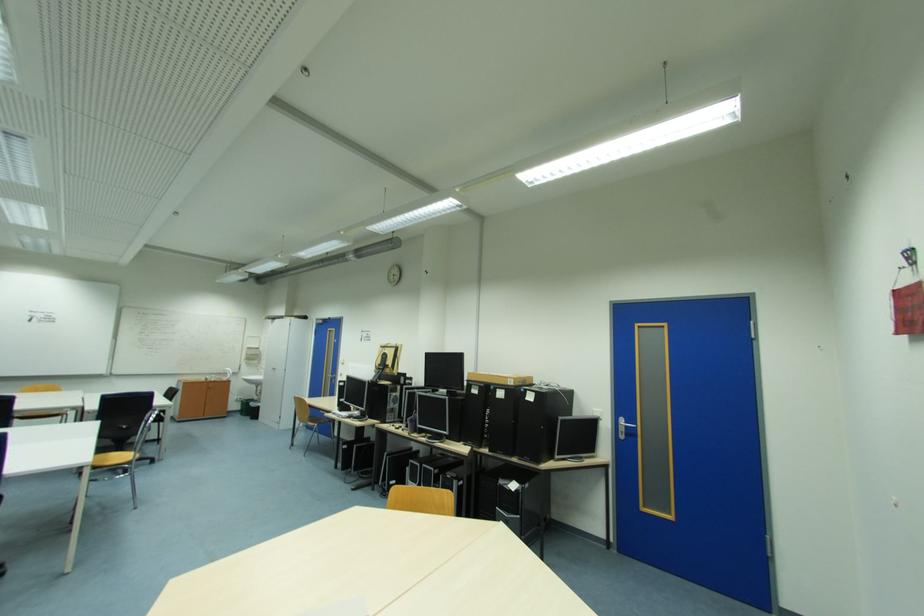
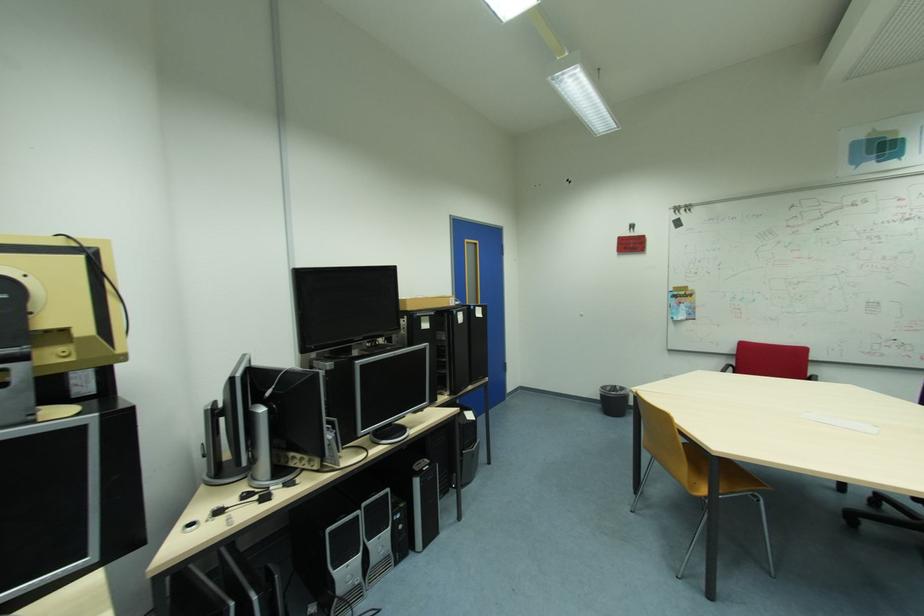
The point at (418, 461) is marked in the first image. Where is the corresponding point in the second image?

(335, 530)